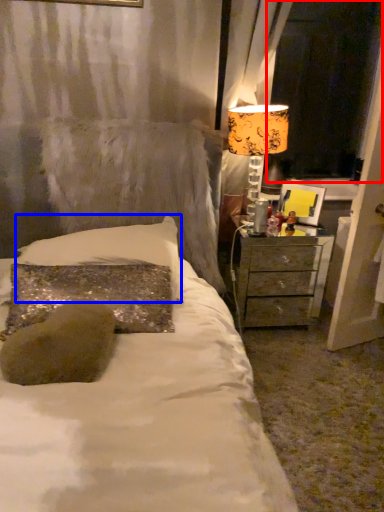
Question: Which object appears closest to the camera in this image, window screen (highlighted by a red box) or pillow (highlighted by a blue box)?

Choices:
 (A) window screen
 (B) pillow

Answer: (B)